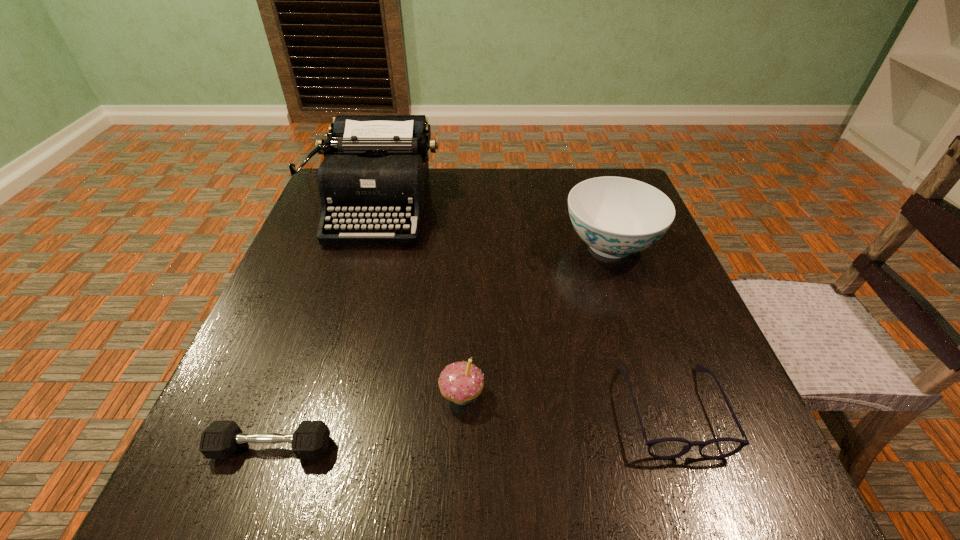
I want to click on vacant area that lies between the typewriter and the dumbbell, so click(x=324, y=327).

Find the location of a particular element. The width and height of the screenshot is (960, 540). vacant area that lies between the dumbbell and the spectacles is located at coordinates (471, 429).

Image resolution: width=960 pixels, height=540 pixels. What are the coordinates of `vacant area that lies between the third object from right to left and the typewriter` in the screenshot? It's located at (420, 301).

Find the location of `free space that is in between the tallest object and the dumbbell`. free space that is in between the tallest object and the dumbbell is located at coordinates (324, 327).

The image size is (960, 540). I want to click on free spot between the spectacles and the tallest object, so click(x=524, y=308).

The height and width of the screenshot is (540, 960). Find the location of `empty space that is in between the dumbbell and the cupcake`. empty space that is in between the dumbbell and the cupcake is located at coordinates (367, 421).

Identify the location of object that is the fourth closest to the spectacles. pyautogui.click(x=375, y=170).

Locate which object is the second closest to the chinaware. Please provide its 2D coordinates. Your answer should be formatted as a tuple, i.e. [(x, y)], where the tuple contains the x and y coordinates of a point satisfying the conditions above.

[(375, 170)]

Where is `free point that satisfies the following two spatial constraints: 1. on the typing side of the chinaware; 2. on the left side of the typewriter`? This screenshot has height=540, width=960. free point that satisfies the following two spatial constraints: 1. on the typing side of the chinaware; 2. on the left side of the typewriter is located at coordinates (366, 245).

The image size is (960, 540). I want to click on vacant space that satisfies the following two spatial constraints: 1. on the typing side of the chinaware; 2. on the right side of the tallest object, so click(x=366, y=245).